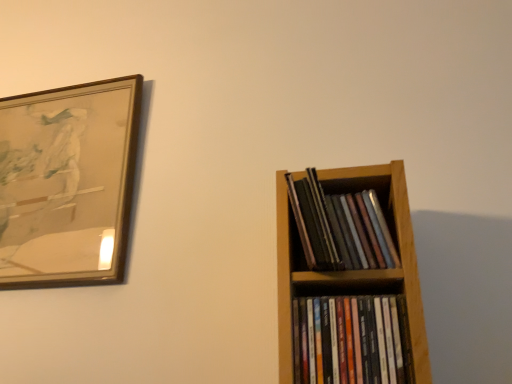
Question: From a real-world perspective, does wooden picture frame at upper left sit lower than matte black books at right, which ranks as the first book in top-to-bottom order?

Choices:
 (A) yes
 (B) no

Answer: (B)

Question: Is wooden picture frame at upper left touching matte black books at right, which ranks as the first book in top-to-bottom order?

Choices:
 (A) yes
 (B) no

Answer: (B)

Question: Is wooden picture frame at upper left facing away from matte black books at right, marked as the 2th book in a bottom-to-top arrangement?

Choices:
 (A) no
 (B) yes

Answer: (A)

Question: From the image's perspective, is wooden picture frame at upper left located above matte black books at right, marked as the 2th book in a bottom-to-top arrangement?

Choices:
 (A) yes
 (B) no

Answer: (A)

Question: Is wooden picture frame at upper left at the left side of matte black books at right, marked as the 2th book in a bottom-to-top arrangement?

Choices:
 (A) yes
 (B) no

Answer: (A)

Question: From a real-world perspective, is matte black books at right, marked as the 2th book in a bottom-to-top arrangement, physically located above or below multicolored glossy cd cases at right, the second book in the top-to-bottom sequence?

Choices:
 (A) above
 (B) below

Answer: (A)

Question: Is matte black books at right, marked as the 2th book in a bottom-to-top arrangement, bigger or smaller than multicolored glossy cd cases at right, which appears as the first book when ordered from the bottom?

Choices:
 (A) big
 (B) small

Answer: (B)

Question: Which is correct: matte black books at right, marked as the 2th book in a bottom-to-top arrangement, is inside multicolored glossy cd cases at right, which appears as the first book when ordered from the bottom, or outside of it?

Choices:
 (A) inside
 (B) outside

Answer: (B)

Question: Considering their positions, is matte black books at right, marked as the 2th book in a bottom-to-top arrangement, located in front of or behind multicolored glossy cd cases at right, which appears as the first book when ordered from the bottom?

Choices:
 (A) behind
 (B) front

Answer: (A)

Question: Relative to wooden picture frame at upper left, is multicolored glossy cd cases at right, the second book in the top-to-bottom sequence, in front or behind?

Choices:
 (A) behind
 (B) front

Answer: (B)

Question: From the image's perspective, is multicolored glossy cd cases at right, the second book in the top-to-bottom sequence, positioned above or below wooden picture frame at upper left?

Choices:
 (A) below
 (B) above

Answer: (A)

Question: Considering the positions of multicolored glossy cd cases at right, the second book in the top-to-bottom sequence, and wooden picture frame at upper left in the image, is multicolored glossy cd cases at right, the second book in the top-to-bottom sequence, wider or thinner than wooden picture frame at upper left?

Choices:
 (A) wide
 (B) thin

Answer: (A)

Question: Considering the positions of multicolored glossy cd cases at right, which appears as the first book when ordered from the bottom, and wooden picture frame at upper left in the image, is multicolored glossy cd cases at right, which appears as the first book when ordered from the bottom, bigger or smaller than wooden picture frame at upper left?

Choices:
 (A) big
 (B) small

Answer: (B)

Question: Considering the positions of wooden picture frame at upper left and multicolored glossy cd cases at right, which appears as the first book when ordered from the bottom, in the image, is wooden picture frame at upper left wider or thinner than multicolored glossy cd cases at right, which appears as the first book when ordered from the bottom,?

Choices:
 (A) thin
 (B) wide

Answer: (A)

Question: Considering the positions of point (55, 112) and point (345, 370), is point (55, 112) closer or farther from the camera than point (345, 370)?

Choices:
 (A) closer
 (B) farther

Answer: (B)